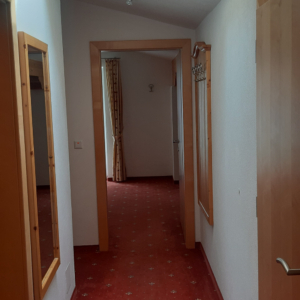
Image resolution: width=300 pixels, height=300 pixels. What are the coordinates of `hooks` in the screenshot? It's located at (203, 69), (197, 71).